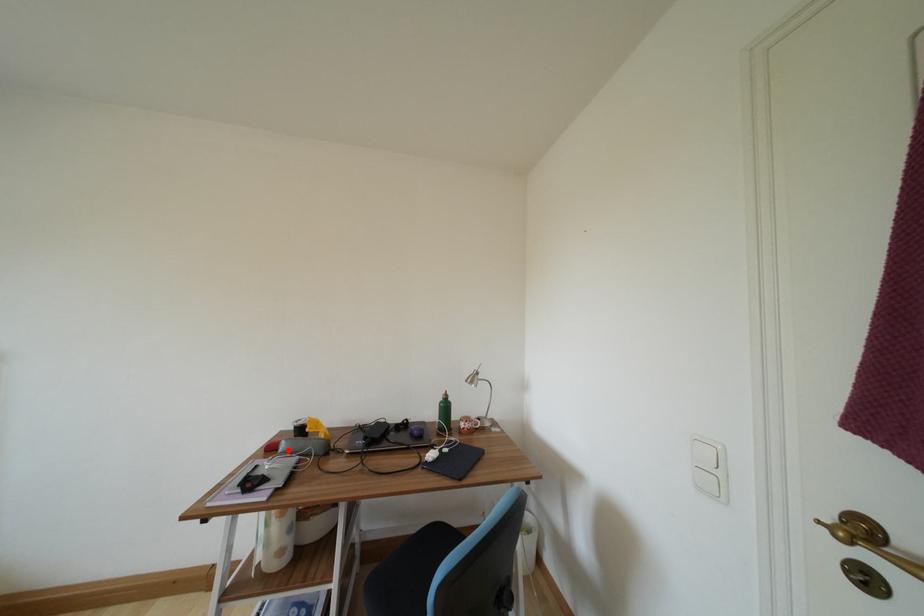
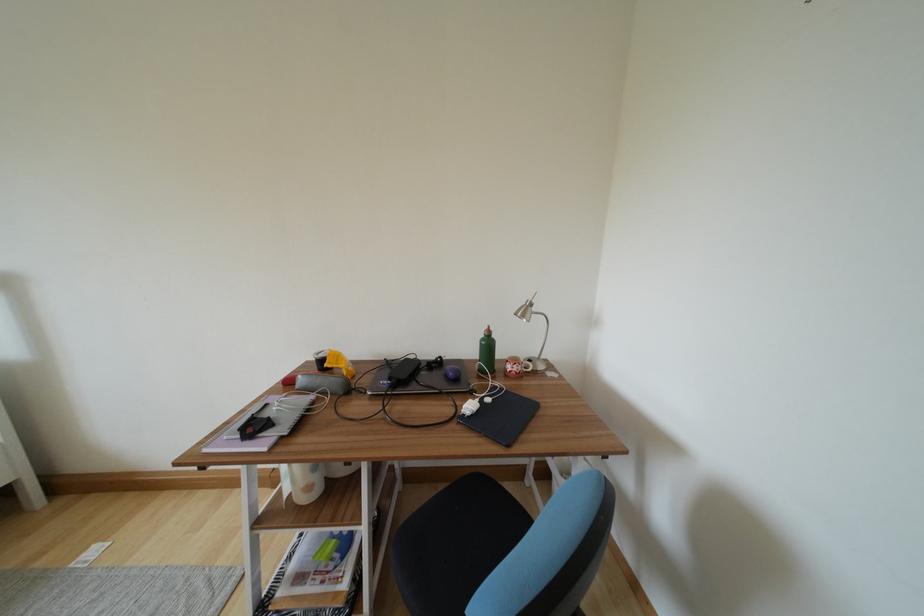
Question: I am providing you with two images of the same scene from different viewpoints. Given a red point in image1, look at the same physical point in image2. Is it:

Choices:
 (A) Closer to the viewpoint
 (B) Farther from the viewpoint

Answer: (A)